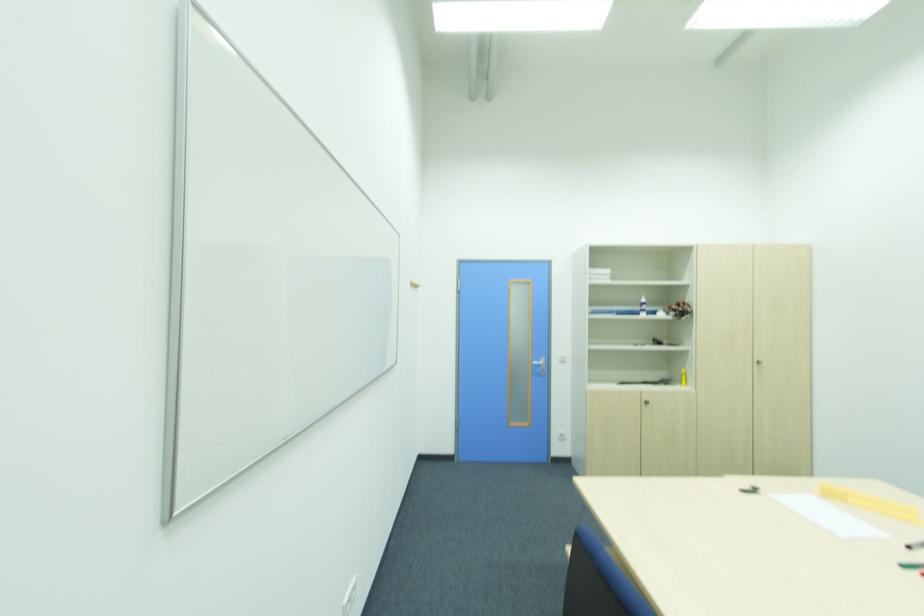
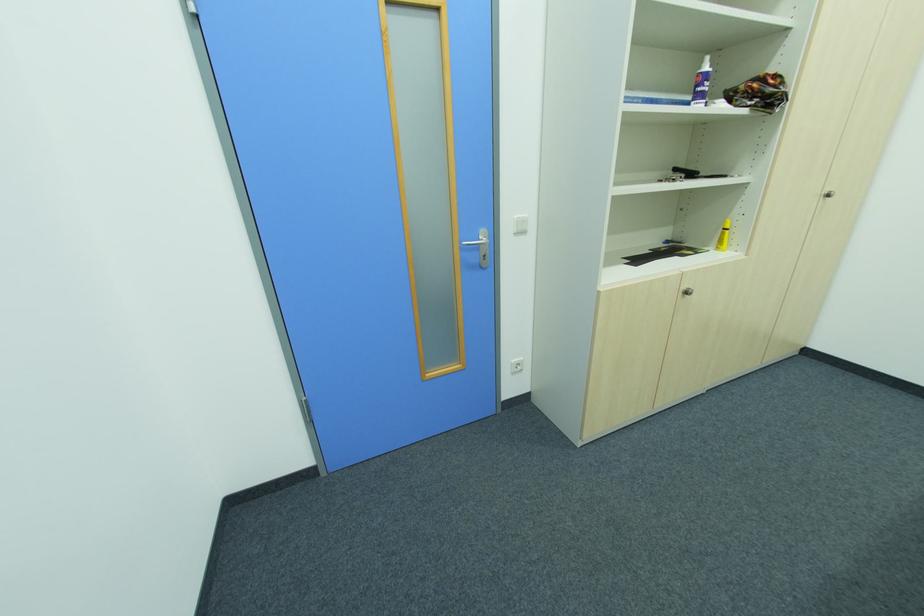
The point at (647, 305) is marked in the first image. Where is the corresponding point in the second image?

(708, 78)